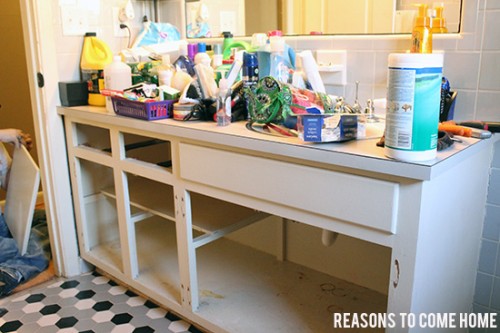
Identify the location of mirror. The width and height of the screenshot is (500, 333). [x=347, y=13].